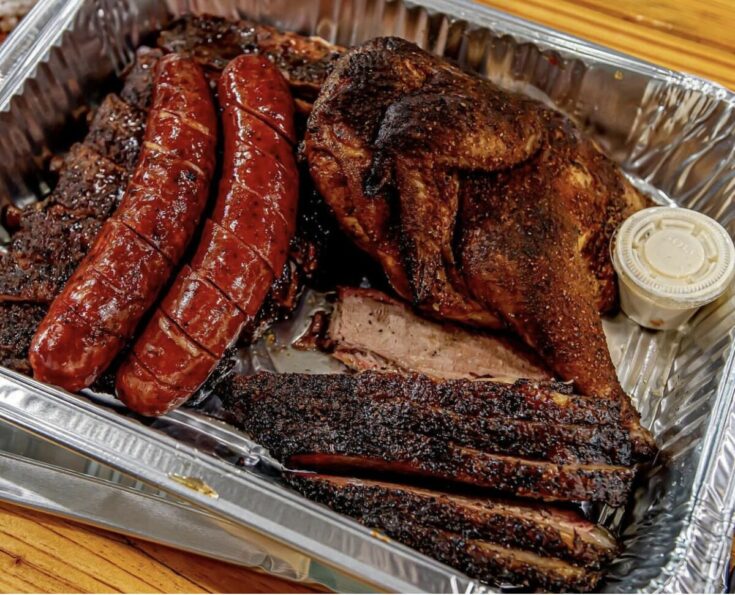
Locate an element on the screen. Image resolution: width=735 pixels, height=595 pixels. plastic container is located at coordinates (667, 284).